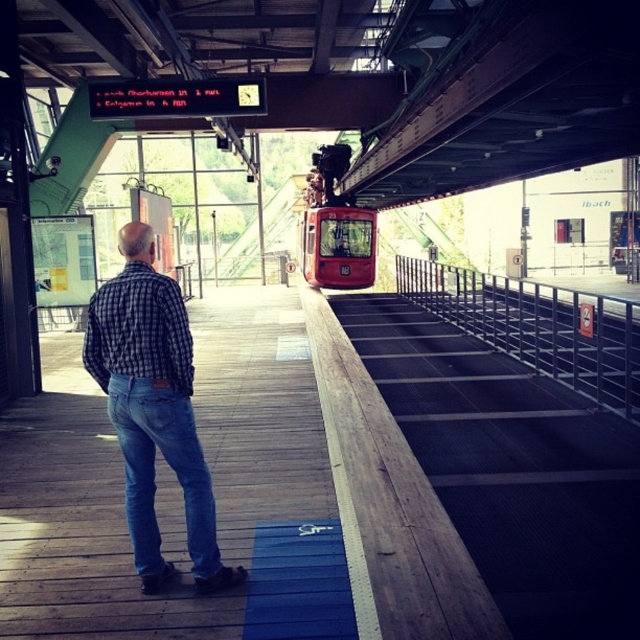
Based on the scene description, what object is located at the coordinates point (513,468)?

The point (513,468) indicates smooth metal train track at center.

You are a fashion designer observing a man at a tram station. You notice he is wearing a checkered fabric shirt at center and blue denim jeans at lower left. Which piece of clothing is positioned to the left?

The checkered fabric shirt at center is positioned on the left side of blue denim jeans at lower left.

You are a fashion designer observing the scene at the tram station. You notice the checkered fabric shirt at center and the blue denim jeans at lower left. Which clothing item would you recommend for a design that requires more fabric?

The checkered fabric shirt at center is bigger than the blue denim jeans at lower left, so it would require more fabric and is the better choice for designs needing more material.